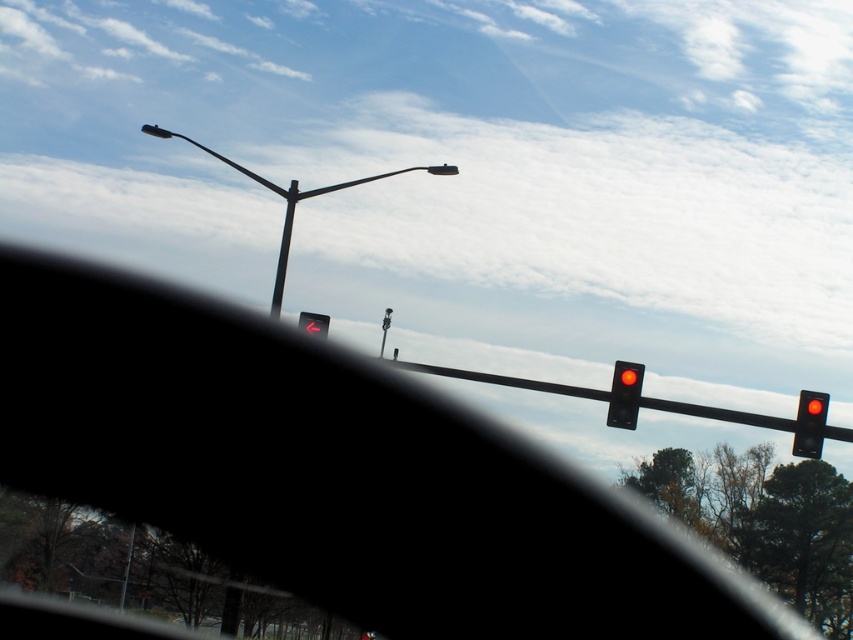
Image resolution: width=853 pixels, height=640 pixels. I want to click on matte black traffic light at right, so click(809, 422).

Can you confirm if matte black traffic light at right is shorter than metallic pole at center?

Correct, matte black traffic light at right is not as tall as metallic pole at center.

Between point (817, 442) and point (289, 204), which one is positioned in front?

Point (817, 442)

Locate an element on the screen. Image resolution: width=853 pixels, height=640 pixels. matte black traffic light at right is located at coordinates (809, 422).

Which of these two, transparent glass windshield at center or matte black traffic light at right, stands shorter?

Standing shorter between the two is matte black traffic light at right.

Does transparent glass windshield at center have a larger size compared to matte black traffic light at right?

Correct, transparent glass windshield at center is larger in size than matte black traffic light at right.

Where is `transparent glass windshield at center`? transparent glass windshield at center is located at coordinates (334, 472).

Locate an element on the screen. This screenshot has width=853, height=640. transparent glass windshield at center is located at coordinates (334, 472).

Which is below, matte black street light at upper left or metallic pole at center?

metallic pole at center is below.

Is point (155, 131) positioned before point (271, 305)?

No, it is not.

The image size is (853, 640). I want to click on matte black street light at upper left, so click(x=291, y=198).

Identify the location of matte black street light at upper left. point(291,198).